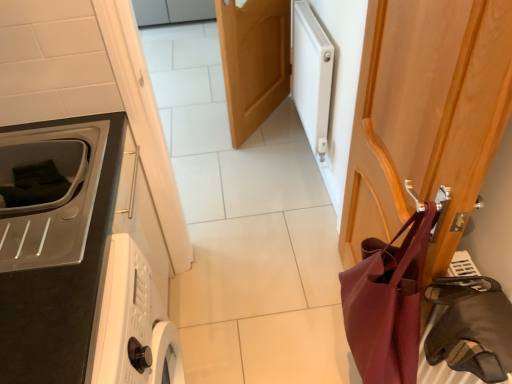
Question: Based on their positions, is matte burgundy leather shoulder bag at right located to the left or right of matte black microwave at left?

Choices:
 (A) left
 (B) right

Answer: (B)

Question: Looking at the image, does matte burgundy leather shoulder bag at right seem bigger or smaller compared to matte black microwave at left?

Choices:
 (A) small
 (B) big

Answer: (B)

Question: Which object is the closest to the leather-like brown bag at right?

Choices:
 (A) matte black microwave at left
 (B) matte burgundy leather shoulder bag at right
 (C) wooden door at center, which is counted as the 1th door, starting from the back
 (D) wooden coat hanger at right, which is the 2th door in left-to-right order
 (E) white matte radiator at upper right

Answer: (B)

Question: Considering the real-world distances, which object is closest to the leather-like brown bag at right?

Choices:
 (A) wooden door at center, the 2th door positioned from the front
 (B) white matte radiator at upper right
 (C) matte black microwave at left
 (D) matte burgundy leather shoulder bag at right
 (E) wooden coat hanger at right, placed as the 1th door when sorted from front to back

Answer: (D)